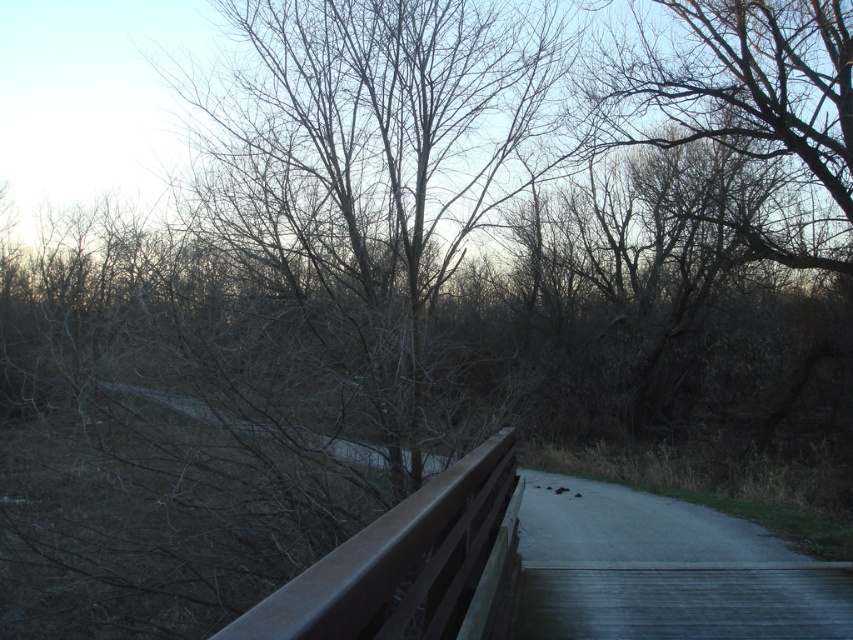
Question: Is bare branches at center in front of metallic brown railing at center?

Choices:
 (A) yes
 (B) no

Answer: (B)

Question: Which object is closer to the camera taking this photo?

Choices:
 (A) metallic brown railing at center
 (B) bare branches at center

Answer: (A)

Question: Is bare branches at center to the right of metallic brown railing at center from the viewer's perspective?

Choices:
 (A) no
 (B) yes

Answer: (A)

Question: Does bare branches at center appear on the left side of metallic brown railing at center?

Choices:
 (A) no
 (B) yes

Answer: (B)